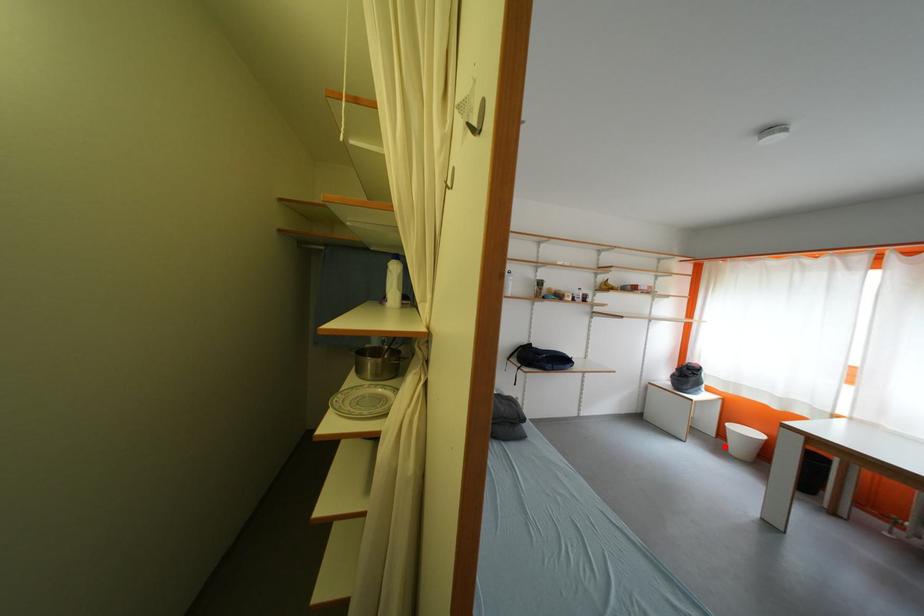
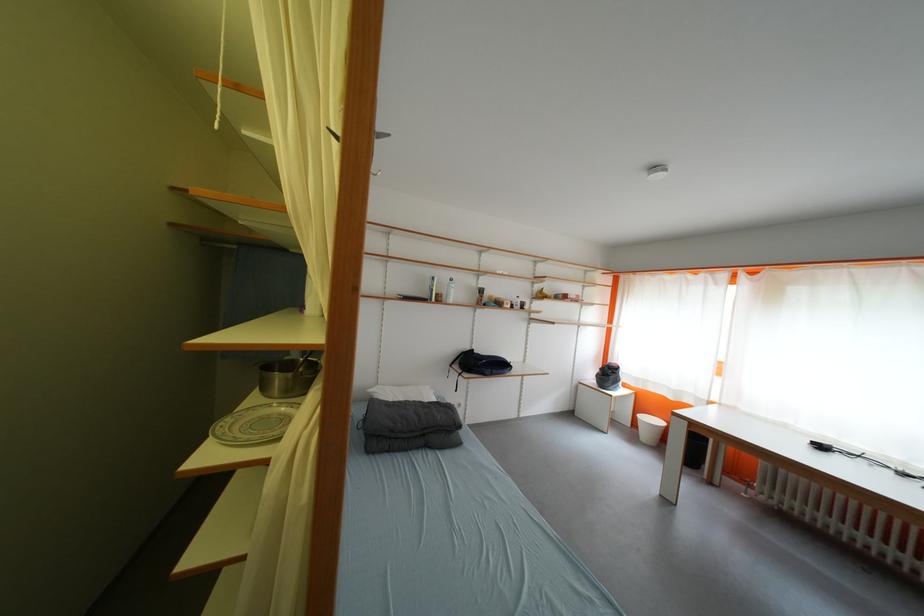
In the second image, find the point that corresponds to the highlighted location in the first image.

(639, 436)